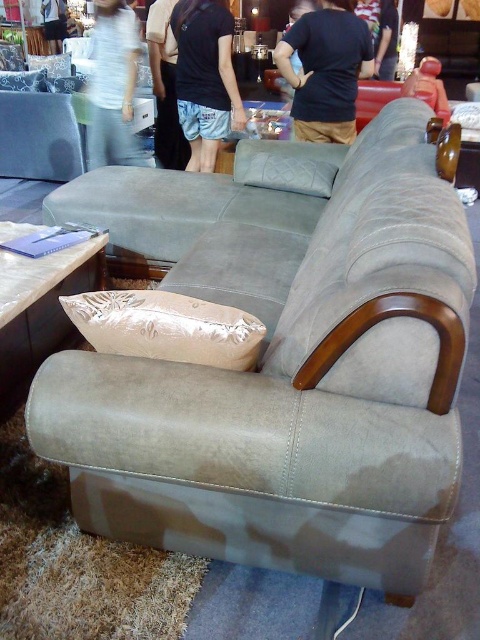
Which is more to the left, satin white table at lower left or suede cushion at center?

From the viewer's perspective, satin white table at lower left appears more on the left side.

Does satin white table at lower left have a lesser height compared to suede cushion at center?

Incorrect, satin white table at lower left's height does not fall short of suede cushion at center's.

I want to click on satin white table at lower left, so click(x=39, y=310).

Is blue denim shorts at center below light brown fabric pants at center?

Yes, blue denim shorts at center is below light brown fabric pants at center.

Who is taller, blue denim shorts at center or light brown fabric pants at center?

light brown fabric pants at center is taller.

This screenshot has width=480, height=640. Find the location of `blue denim shorts at center`. blue denim shorts at center is located at coordinates (204, 76).

You are a GUI agent. You are given a task and a screenshot of the screen. Output one action in this format:
    pyautogui.click(x=<x>, y=<y>)
    Task: Click on the blue denim shorts at center
    The image size is (480, 640).
    Given the screenshot: What is the action you would take?
    pyautogui.click(x=204, y=76)

Does blue denim shorts at center have a lesser height compared to satin beige pillow at upper left?

No.

What do you see at coordinates (204, 76) in the screenshot?
I see `blue denim shorts at center` at bounding box center [204, 76].

Identify the location of blue denim shorts at center. This screenshot has width=480, height=640. (204, 76).